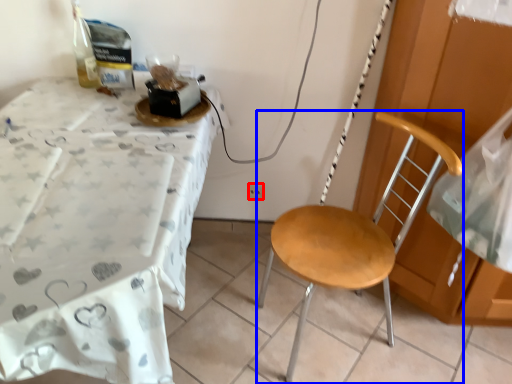
Question: Which object is closer to the camera taking this photo, power outlet (highlighted by a red box) or chair (highlighted by a blue box)?

Choices:
 (A) power outlet
 (B) chair

Answer: (B)